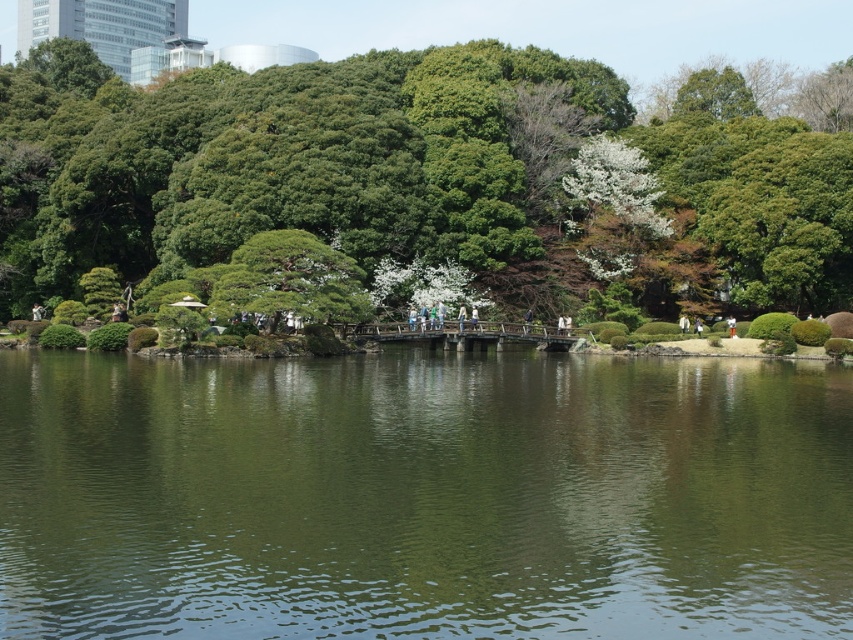
You are planning to install a small wooden bench in the Japanese garden. The bench is 1.5 meters long and you want to place it between the green reflective water at center and the green leafy tree at center. Is there enough space between them to fit the bench?

The green reflective water at center and green leafy tree at center are 31.31 meters apart from each other. Since the bench is only 1.5 meters long, there is more than enough space between them to fit the bench comfortably.

Consider the image. You are standing in the Japanese garden and want to take a photo of the green reflective water at center and the green leafy tree at center. Which object will appear larger in your photo?

The green reflective water at center will appear larger in your photo because it is closer to the viewer than the green leafy tree at center.

You are standing at the entrance of the garden and want to locate the green reflective water at center. According to the coordinates provided, where would you find it in the image?

The green reflective water at center is located at the coordinates point (422, 497) in the image.